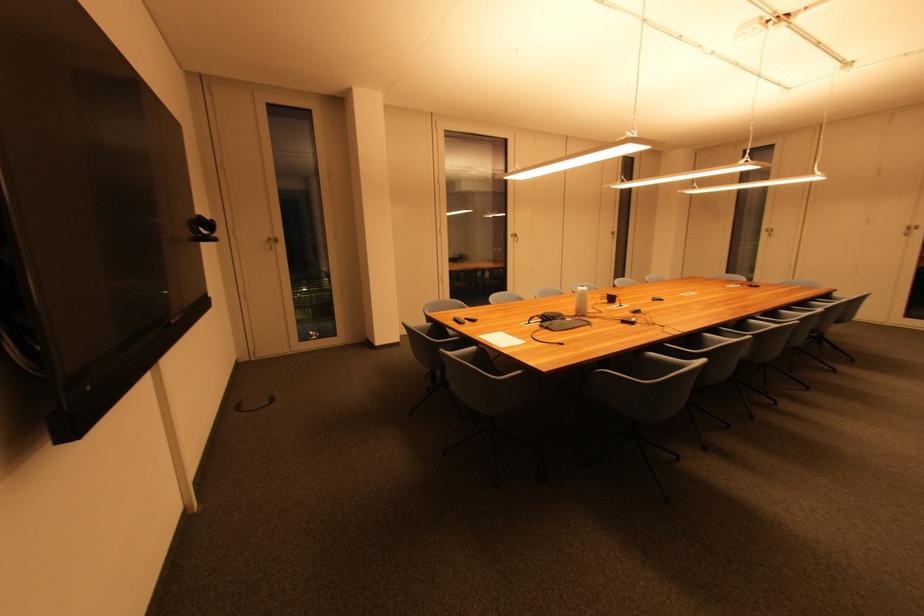
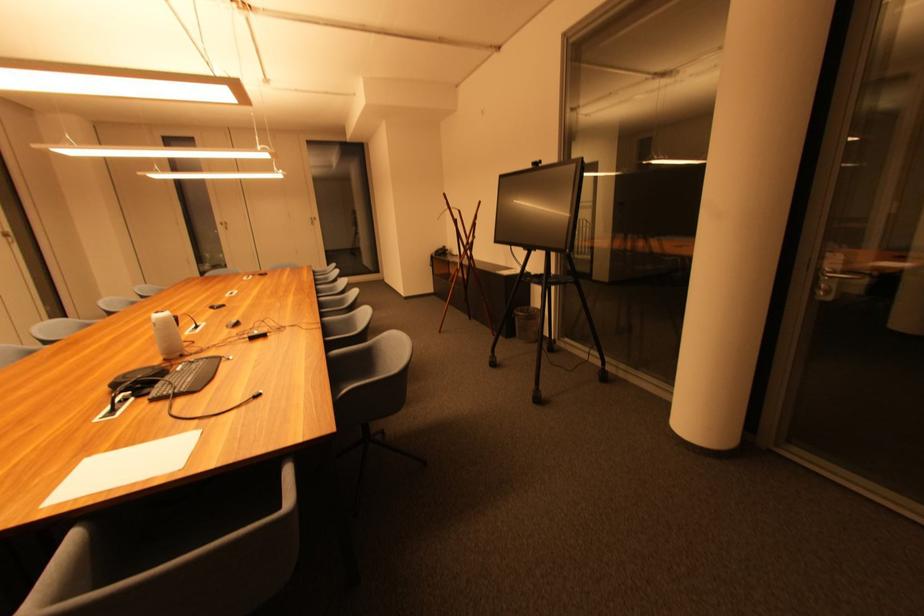
Where in the second image is the point corresponding to (x=676, y=338) from the first image?

(325, 331)